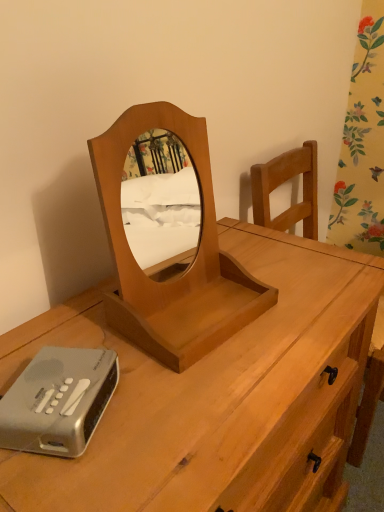
The height and width of the screenshot is (512, 384). In order to click on vacant point to the left of light brown wood mirror at center in this screenshot , I will do `click(69, 324)`.